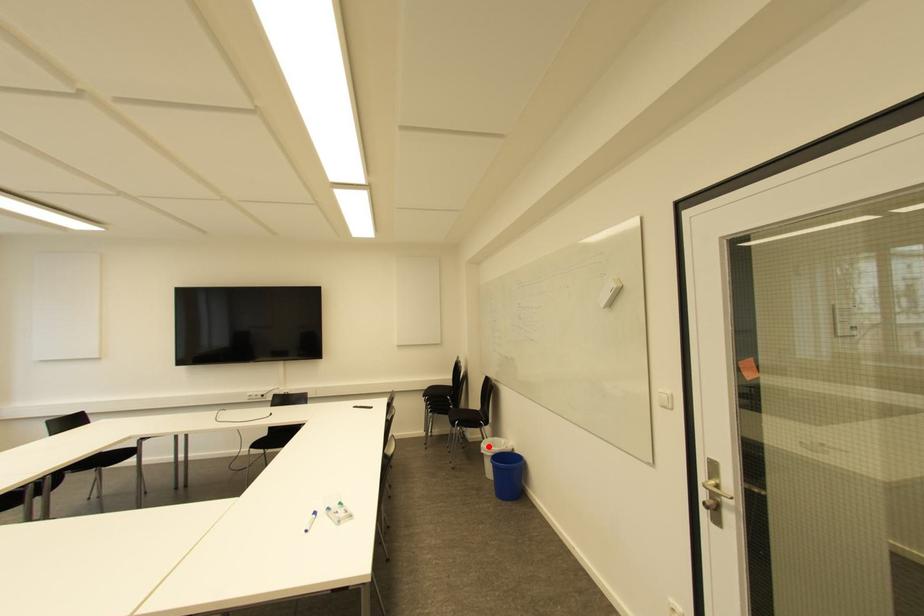
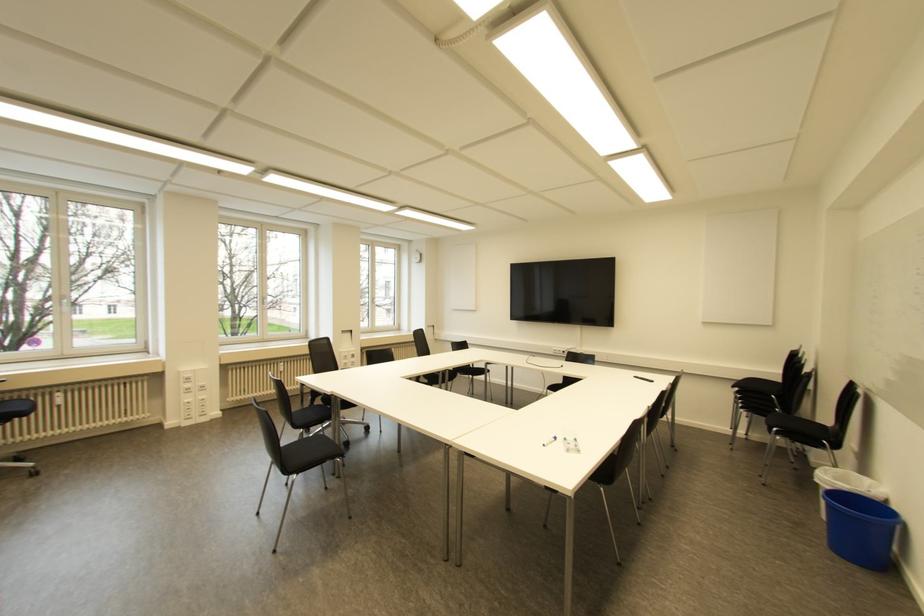
Question: I am providing you with two images of the same scene from different viewpoints. Image1 has a red point marked. In image2, the corresponding 3D location appears at what relative position? Reply with the corresponding letter.

Choices:
 (A) Closer
 (B) Farther

Answer: (A)